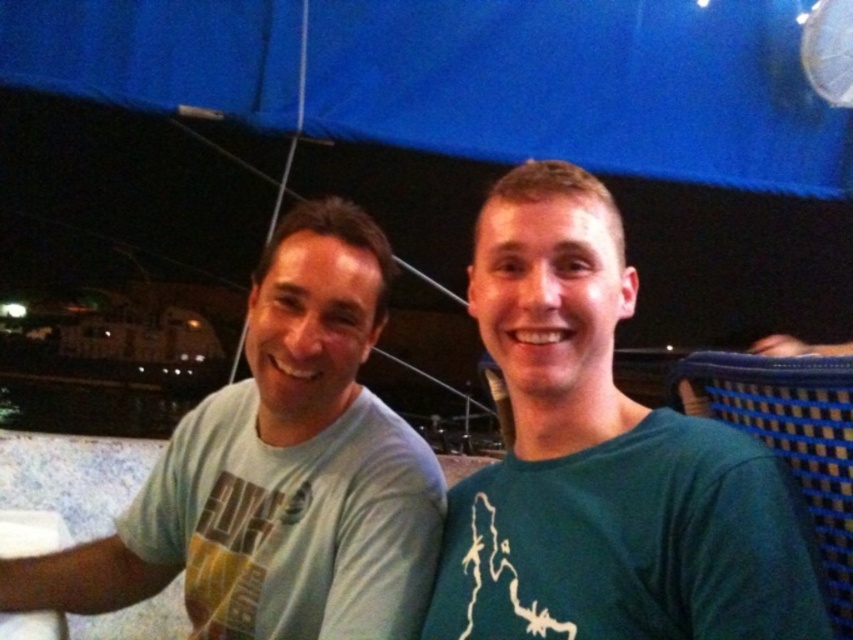
You are a photographer setting up for an outdoor event under a blue canopy. You need to ensure that the light blue cotton shirt at center and the green matte shirt at right are both visible in your shot. Considering their sizes, which shirt might require more space in the frame to capture fully?

The light blue cotton shirt at center requires more space in the frame since its width surpasses that of the green matte shirt at right.

From the picture: You are standing in front of the image and want to locate the green matte shirt at right. According to the coordinates provided, where exactly is it positioned?

The green matte shirt at right is located at point 0.722 on the x axis and 0.709 on the y axis.

You are standing at the origin of the coordinate system in the image. You want to move towards the light blue cotton shirt at center located at point (604,460). Is there any object between you and the light blue cotton shirt at center?

There is no object between you and the light blue cotton shirt at center because the scene description does not mention any obstacles between the origin and the point (604,460).